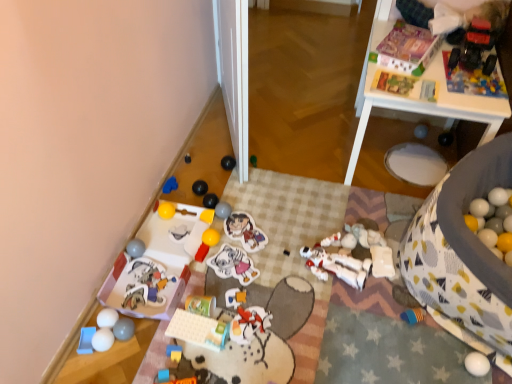
Image resolution: width=512 pixels, height=384 pixels. Find the location of `vacant space in between white matte sticker at center, which is the nineteenth toy from left to right, and white matte doll at center, acting as the 22th toy starting from the left`. vacant space in between white matte sticker at center, which is the nineteenth toy from left to right, and white matte doll at center, acting as the 22th toy starting from the left is located at coordinates (281, 271).